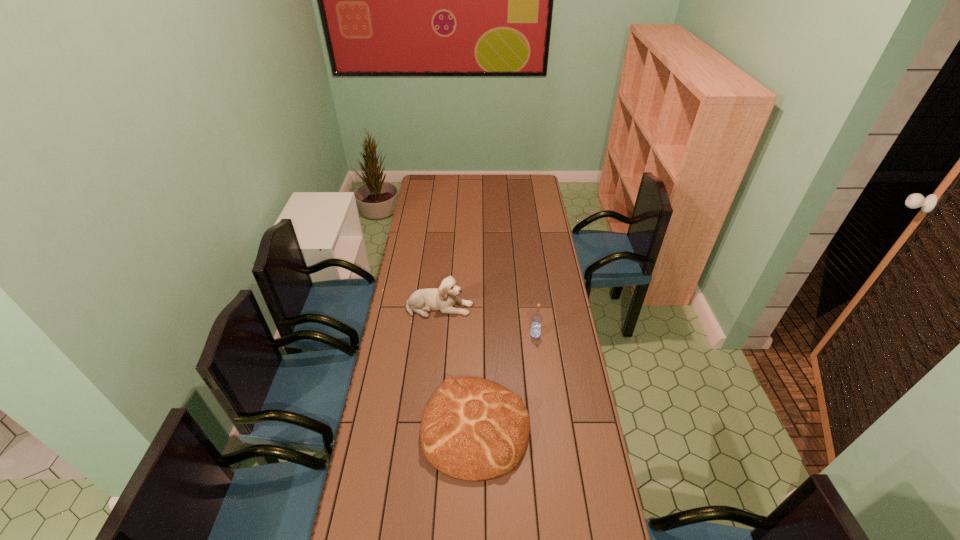
Find the location of a particular element. This screenshot has width=960, height=540. the rightmost object is located at coordinates (535, 331).

Locate an element on the screen. The image size is (960, 540). vodka is located at coordinates (535, 331).

Locate an element on the screen. This screenshot has height=540, width=960. puppy is located at coordinates (444, 298).

The height and width of the screenshot is (540, 960). Identify the location of bread. (473, 429).

What are the coordinates of `free region located on the back of the rightmost object` in the screenshot? It's located at (529, 283).

Identify the location of free space located 0.160m on the front-facing side of the farthest object. Image resolution: width=960 pixels, height=540 pixels. (510, 307).

Locate an element on the screen. The height and width of the screenshot is (540, 960). free location located on the back of the bread is located at coordinates (476, 348).

I want to click on object located in the left edge section of the desktop, so click(x=444, y=298).

This screenshot has width=960, height=540. Identify the location of object that is positioned at the right edge. (535, 331).

I want to click on free space at the left edge of the desktop, so point(408,231).